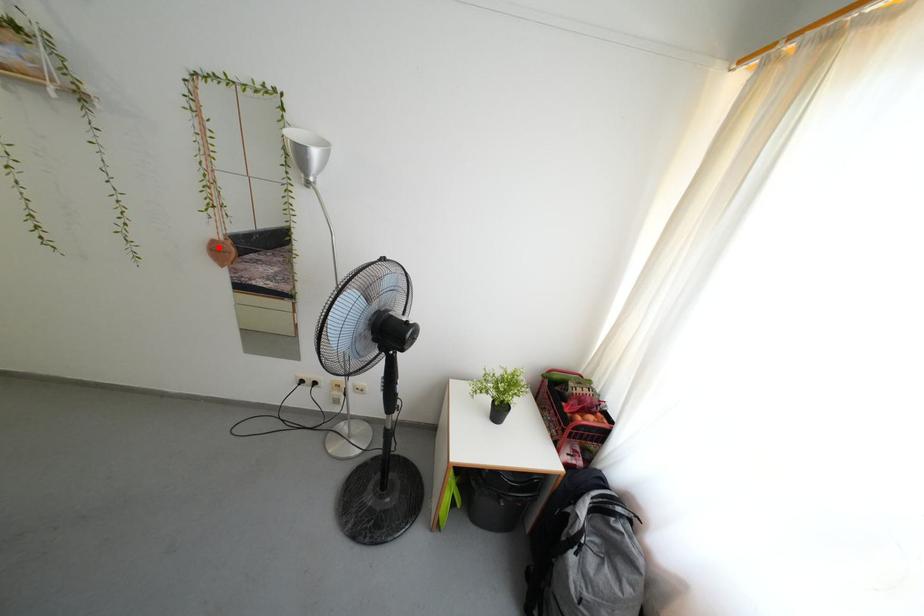
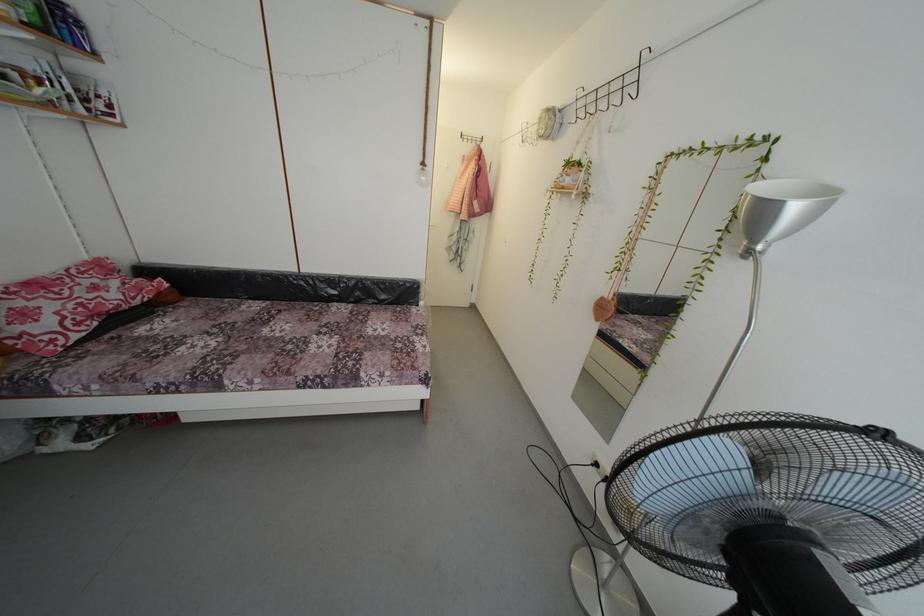
Find the pixel in the second image that matches the highlighted location in the first image.

(608, 305)